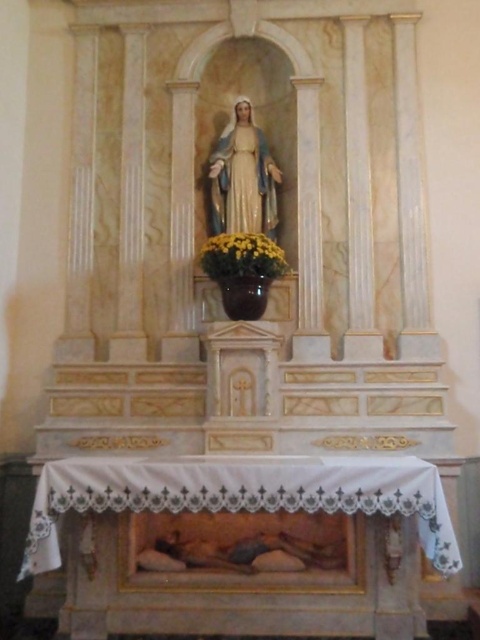
You are an interior designer assessing the altar setup. You need to choose between the yellow matte vase at center and the glossy ceramic vase at center based on their height. Which one should you select if you want a taller vase for the flowers?

The yellow matte vase at center has a greater height compared to the glossy ceramic vase at center, so you should select the yellow matte vase at center for a taller option.

You are a maintenance worker in the church who needs to move the yellow matte vase at center and the glossy ceramic vase at center closer together. Currently, how far apart are they?

The distance between the yellow matte vase at center and the glossy ceramic vase at center is 6.69 inches.